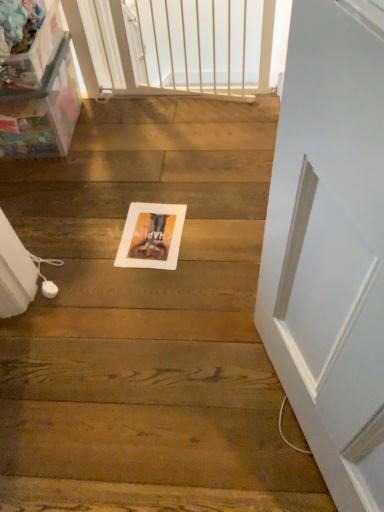
Measure the distance between white paper postcard at center and camera.

white paper postcard at center is 1.42 meters away from camera.

Describe the element at coordinates (151, 236) in the screenshot. The image size is (384, 512). I see `white paper postcard at center` at that location.

Looking at this image, measure the distance between point (x=119, y=261) and camera.

1.45 meters.

The image size is (384, 512). Find the location of `white paper postcard at center`. white paper postcard at center is located at coordinates (151, 236).

What is the approximate height of white matte screen door at upper center?

The height of white matte screen door at upper center is 17.99 inches.

What do you see at coordinates (81, 46) in the screenshot?
I see `white matte screen door at upper center` at bounding box center [81, 46].

Find the location of a particular element. white matte screen door at upper center is located at coordinates (81, 46).

Locate an element on the screen. This screenshot has width=384, height=512. white paper postcard at center is located at coordinates (151, 236).

Visually, is white paper postcard at center positioned to the left or to the right of white matte screen door at upper center?

Clearly, white paper postcard at center is on the left of white matte screen door at upper center in the image.

Relative to white matte screen door at upper center, is white paper postcard at center in front or behind?

white paper postcard at center is in front of white matte screen door at upper center.

Considering the points (139, 264) and (265, 37), which point is behind, point (139, 264) or point (265, 37)?

Positioned behind is point (265, 37).

From the image's perspective, between white paper postcard at center and white matte screen door at upper center, who is located below?

white paper postcard at center.

From a real-world perspective, between white paper postcard at center and white matte screen door at upper center, who is vertically higher?

From a 3D spatial view, white matte screen door at upper center is above.

Considering the relative sizes of white paper postcard at center and white matte screen door at upper center in the image provided, is white paper postcard at center thinner than white matte screen door at upper center?

Incorrect, the width of white paper postcard at center is not less than that of white matte screen door at upper center.

Does white paper postcard at center have a lesser height compared to white matte screen door at upper center?

Yes, white paper postcard at center is shorter than white matte screen door at upper center.

Can you confirm if white paper postcard at center is smaller than white matte screen door at upper center?

Yes, white paper postcard at center is smaller than white matte screen door at upper center.

Does white paper postcard at center contain white matte screen door at upper center?

No, white matte screen door at upper center is not surrounded by white paper postcard at center.

Is white paper postcard at center far away from white matte screen door at upper center?

white paper postcard at center is actually quite close to white matte screen door at upper center.

Is white paper postcard at center facing towards white matte screen door at upper center?

Yes.

How many degrees apart are the facing directions of white paper postcard at center and white matte screen door at upper center?

white paper postcard at center and white matte screen door at upper center are facing 179 degrees away from each other.

Locate an element on the screen. screen door on the right of white paper postcard at center is located at coordinates (81, 46).

Considering the positions of objects white matte screen door at upper center and white paper postcard at center in the image provided, who is more to the left, white matte screen door at upper center or white paper postcard at center?

white paper postcard at center is more to the left.

Relative to white paper postcard at center, is white matte screen door at upper center in front or behind?

white matte screen door at upper center is behind white paper postcard at center.

Considering the points (273, 14) and (151, 262), which point is in front, point (273, 14) or point (151, 262)?

Positioned in front is point (151, 262).

From the image's perspective, is white matte screen door at upper center over white paper postcard at center?

Correct, white matte screen door at upper center appears higher than white paper postcard at center in the image.

From a real-world perspective, which object rests below the other?

white paper postcard at center.

Which of these two, white matte screen door at upper center or white paper postcard at center, is thinner?

white matte screen door at upper center.

Can you confirm if white matte screen door at upper center is shorter than white paper postcard at center?

In fact, white matte screen door at upper center may be taller than white paper postcard at center.

Between white matte screen door at upper center and white paper postcard at center, which one has larger size?

white matte screen door at upper center.

In the scene shown: Would you say white matte screen door at upper center is inside or outside white paper postcard at center?

white matte screen door at upper center lies outside white paper postcard at center.

Is white matte screen door at upper center with white paper postcard at center?

They are not placed beside each other.

Is white paper postcard at center at the back of white matte screen door at upper center?

white matte screen door at upper center is not turned away from white paper postcard at center.

What's the angular difference between white matte screen door at upper center and white paper postcard at center's facing directions?

The angle between the facing direction of white matte screen door at upper center and the facing direction of white paper postcard at center is 179 degrees.

This screenshot has width=384, height=512. What are the coordinates of `postcard lying below the white matte screen door at upper center (from the image's perspective)` in the screenshot? It's located at (151, 236).

Find the location of a particular element. The height and width of the screenshot is (512, 384). postcard below the white matte screen door at upper center (from a real-world perspective) is located at coordinates (151, 236).

At what (x,y) coordinates should I click in order to perform the action: click on screen door above the white paper postcard at center (from a real-world perspective). Please return your answer as a coordinate pair (x, y). Image resolution: width=384 pixels, height=512 pixels. Looking at the image, I should click on (81, 46).